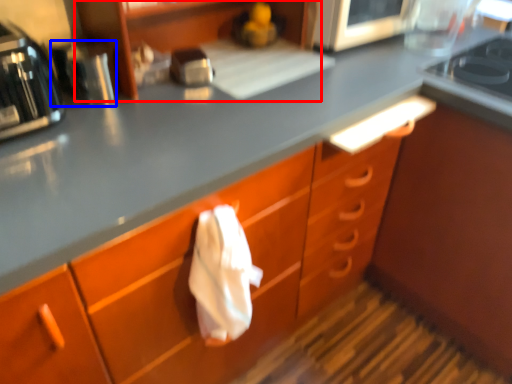
Question: Which object appears farthest to the camera in this image, shelf (highlighted by a red box) or appliance (highlighted by a blue box)?

Choices:
 (A) shelf
 (B) appliance

Answer: (B)